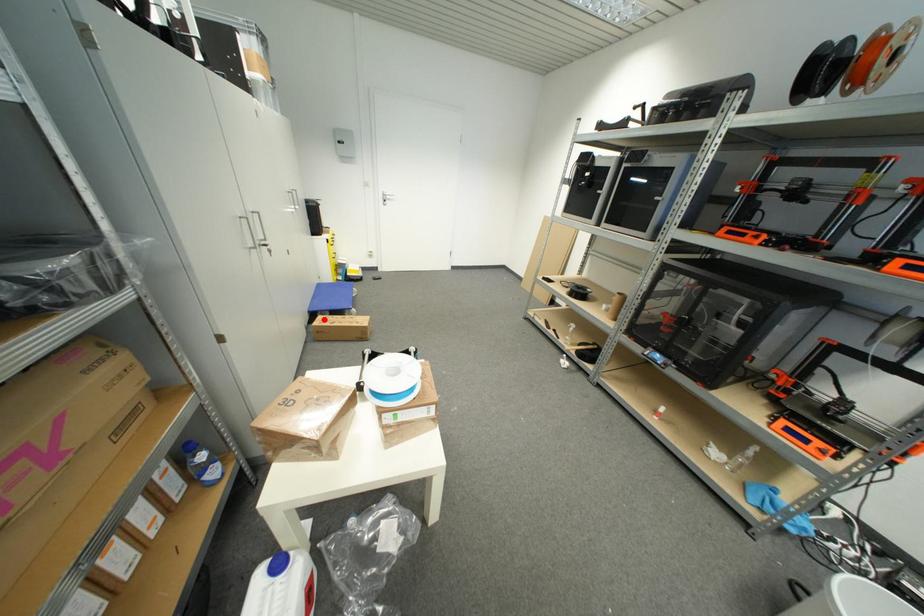
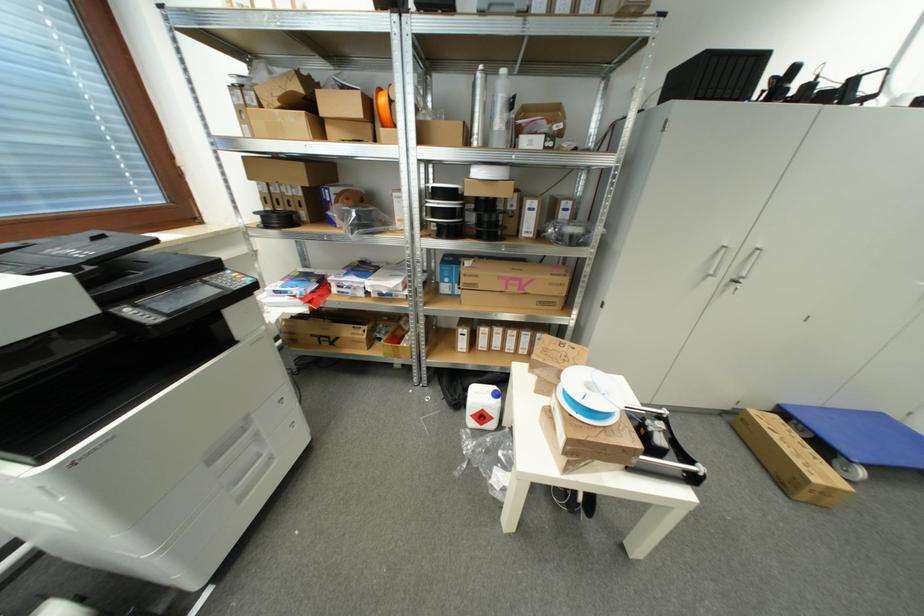
Locate, in the second image, the point that corresponds to the highlighted location in the first image.

(781, 419)